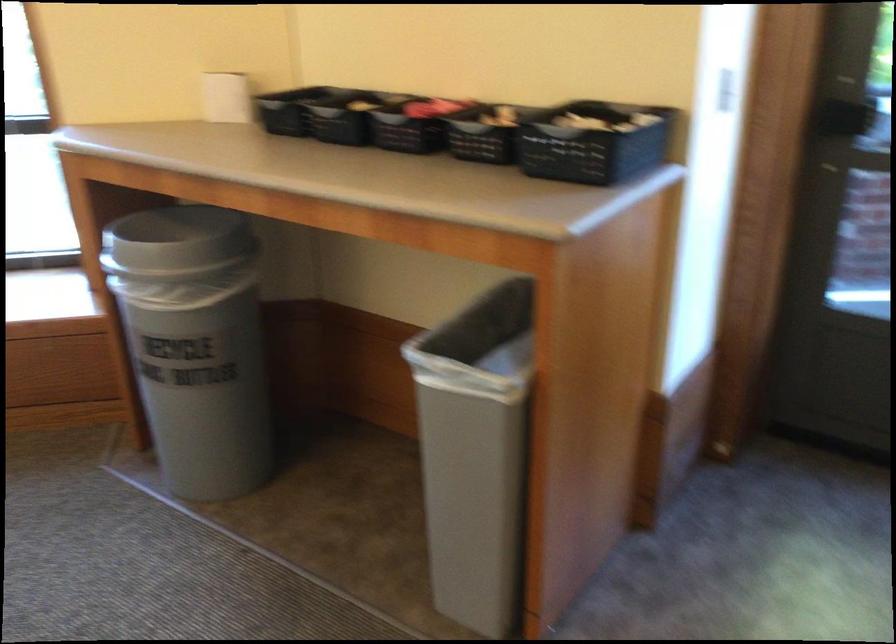
Where is `white light switch`? The height and width of the screenshot is (644, 896). white light switch is located at coordinates (727, 90).